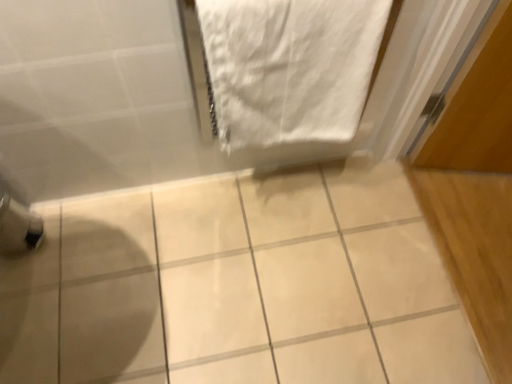
Question: Is white glossy tile at center wider or thinner than white cotton towel at upper right?

Choices:
 (A) thin
 (B) wide

Answer: (B)

Question: Looking at the image, does white glossy tile at center seem bigger or smaller compared to white cotton towel at upper right?

Choices:
 (A) small
 (B) big

Answer: (B)

Question: Does point (332, 278) appear closer or farther from the camera than point (265, 39)?

Choices:
 (A) farther
 (B) closer

Answer: (A)

Question: In the image, is white cotton towel at upper right on the left side or the right side of white glossy tile at center?

Choices:
 (A) right
 (B) left

Answer: (A)

Question: Based on their sizes in the image, would you say white cotton towel at upper right is bigger or smaller than white glossy tile at center?

Choices:
 (A) small
 (B) big

Answer: (A)

Question: Is white cotton towel at upper right spatially inside white glossy tile at center, or outside of it?

Choices:
 (A) outside
 (B) inside

Answer: (A)

Question: From the image's perspective, is white cotton towel at upper right positioned above or below white glossy tile at center?

Choices:
 (A) below
 (B) above

Answer: (B)